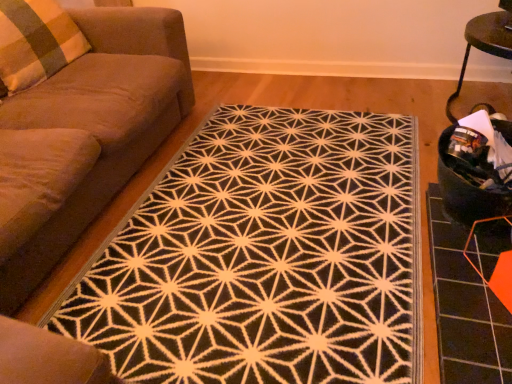
What do you see at coordinates (465, 308) in the screenshot? I see `orange hexagonal tile at lower right` at bounding box center [465, 308].

The width and height of the screenshot is (512, 384). What do you see at coordinates (85, 136) in the screenshot?
I see `suede-like brown couch at left` at bounding box center [85, 136].

This screenshot has height=384, width=512. What do you see at coordinates (264, 257) in the screenshot?
I see `black textured rug at center` at bounding box center [264, 257].

Locate an element on the screen. Image resolution: width=512 pixels, height=384 pixels. black fabric swivel chair at right is located at coordinates (470, 177).

Is black fabric swivel chair at right thinner than orange hexagonal tile at lower right?

Indeed, black fabric swivel chair at right has a lesser width compared to orange hexagonal tile at lower right.

Where is `tile below the black fabric swivel chair at right (from the image's perspective)`? tile below the black fabric swivel chair at right (from the image's perspective) is located at coordinates (465, 308).

Is black fabric swivel chair at right beside orange hexagonal tile at lower right?

They are not placed beside each other.

Which object is closer to the camera taking this photo, plaid fabric pillow at left or black textured rug at center?

black textured rug at center.

Consider the image. Between plaid fabric pillow at left and black textured rug at center, which one has larger width?

With larger width is black textured rug at center.

Could you tell me if plaid fabric pillow at left is turned towards black textured rug at center?

No, plaid fabric pillow at left is not facing towards black textured rug at center.

In the scene shown: Considering the relative sizes of suede-like brown couch at left and black fabric swivel chair at right in the image provided, is suede-like brown couch at left shorter than black fabric swivel chair at right?

In fact, suede-like brown couch at left may be taller than black fabric swivel chair at right.

What's the angular difference between suede-like brown couch at left and black fabric swivel chair at right's facing directions?

88.7 degrees.

From a real-world perspective, between suede-like brown couch at left and black fabric swivel chair at right, who is vertically higher?

suede-like brown couch at left is physically above.

Which object is closer to the camera taking this photo, suede-like brown couch at left or black fabric swivel chair at right?

Positioned in front is suede-like brown couch at left.

Which object is further away from the camera, orange hexagonal tile at lower right or plaid fabric pillow at left?

Positioned behind is plaid fabric pillow at left.

Is plaid fabric pillow at left completely or partially inside orange hexagonal tile at lower right?

No, plaid fabric pillow at left is not a part of orange hexagonal tile at lower right.

Is orange hexagonal tile at lower right bigger or smaller than plaid fabric pillow at left?

Clearly, orange hexagonal tile at lower right is smaller in size than plaid fabric pillow at left.

From the image's perspective, is orange hexagonal tile at lower right below plaid fabric pillow at left?

Correct, orange hexagonal tile at lower right appears lower than plaid fabric pillow at left in the image.

Where is `swivel chair below the plaid fabric pillow at left (from a real-world perspective)`? This screenshot has height=384, width=512. swivel chair below the plaid fabric pillow at left (from a real-world perspective) is located at coordinates (470, 177).

From a real-world perspective, who is located higher, plaid fabric pillow at left or black fabric swivel chair at right?

plaid fabric pillow at left.

Does plaid fabric pillow at left come behind black fabric swivel chair at right?

Yes, plaid fabric pillow at left is further from the viewer.

How far apart are plaid fabric pillow at left and black fabric swivel chair at right?

A distance of 1.94 meters exists between plaid fabric pillow at left and black fabric swivel chair at right.

Is point (445, 233) positioned after point (348, 324)?

That is True.

Considering the relative sizes of orange hexagonal tile at lower right and black textured rug at center in the image provided, is orange hexagonal tile at lower right wider than black textured rug at center?

No.

You are a GUI agent. You are given a task and a screenshot of the screen. Output one action in this format:
    pyautogui.click(x=<x>, y=<y>)
    Task: Click on the mat in front of the orange hexagonal tile at lower right
    The image size is (512, 384).
    Given the screenshot: What is the action you would take?
    pyautogui.click(x=264, y=257)

Is suede-like brown couch at left at the right side of black textured rug at center?

No, suede-like brown couch at left is not to the right of black textured rug at center.

Which of these two, suede-like brown couch at left or black textured rug at center, is thinner?

With smaller width is suede-like brown couch at left.

Considering the relative sizes of suede-like brown couch at left and black textured rug at center in the image provided, is suede-like brown couch at left smaller than black textured rug at center?

Incorrect, suede-like brown couch at left is not smaller in size than black textured rug at center.

Identify the location of tile lying below the black fabric swivel chair at right (from the image's perspective). (465, 308).

Image resolution: width=512 pixels, height=384 pixels. What are the coordinates of `pillow located above the black textured rug at center (from the image's perspective)` in the screenshot? It's located at (35, 43).

Looking at the image, which one is located closer to black fabric swivel chair at right, orange hexagonal tile at lower right or black textured rug at center?

The object closer to black fabric swivel chair at right is orange hexagonal tile at lower right.

Considering their positions, is suede-like brown couch at left positioned further to black fabric swivel chair at right than orange hexagonal tile at lower right?

suede-like brown couch at left is positioned further to the anchor black fabric swivel chair at right.

Based on the photo, which object lies further to the anchor point black fabric swivel chair at right, suede-like brown couch at left or plaid fabric pillow at left?

plaid fabric pillow at left lies further to black fabric swivel chair at right than the other object.

Based on their spatial positions, is plaid fabric pillow at left or orange hexagonal tile at lower right further from black fabric swivel chair at right?

plaid fabric pillow at left lies further to black fabric swivel chair at right than the other object.

From the image, which object appears to be nearer to black textured rug at center, plaid fabric pillow at left or black fabric swivel chair at right?

black fabric swivel chair at right is positioned closer to the anchor black textured rug at center.

Which object lies nearer to the anchor point suede-like brown couch at left, orange hexagonal tile at lower right or black textured rug at center?

Based on the image, black textured rug at center appears to be nearer to suede-like brown couch at left.

Which object lies further to the anchor point black textured rug at center, suede-like brown couch at left or plaid fabric pillow at left?

plaid fabric pillow at left is further to black textured rug at center.

When comparing their distances from suede-like brown couch at left, does black textured rug at center or orange hexagonal tile at lower right seem closer?

Among the two, black textured rug at center is located nearer to suede-like brown couch at left.

Find the location of a particular element. The image size is (512, 384). mat located between suede-like brown couch at left and black fabric swivel chair at right in the left-right direction is located at coordinates (264, 257).

Locate an element on the screen. The height and width of the screenshot is (384, 512). swivel chair situated between black textured rug at center and orange hexagonal tile at lower right from left to right is located at coordinates (470, 177).

The height and width of the screenshot is (384, 512). In order to click on studio couch between plaid fabric pillow at left and black fabric swivel chair at right in this screenshot , I will do `click(85, 136)`.

Where is `mat between suede-like brown couch at left and orange hexagonal tile at lower right`? mat between suede-like brown couch at left and orange hexagonal tile at lower right is located at coordinates (264, 257).